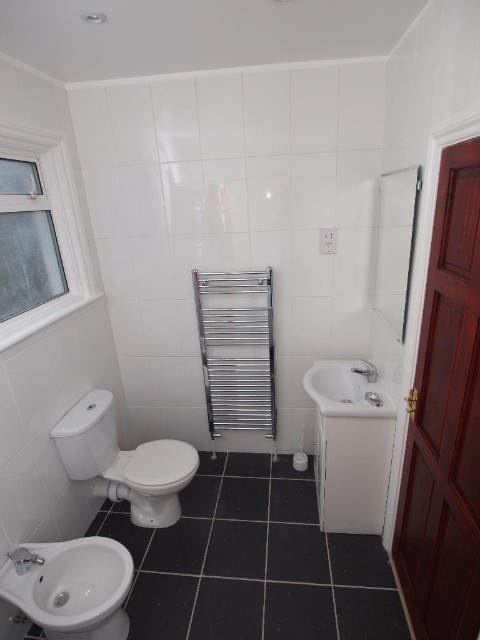
You are standing in the bathroom and need to locate the white glossy bidet at lower left. According to the image coordinates, where exactly is it positioned?

The white glossy bidet at lower left is positioned at the coordinates point (72, 588).

From the picture: You are standing in the bathroom and want to reach both points. Which point, point (82, 545) or point (334, 374), will you reach first?

Point (82, 545) is closer to the viewer than point (334, 374), so you will reach point (82, 545) first.